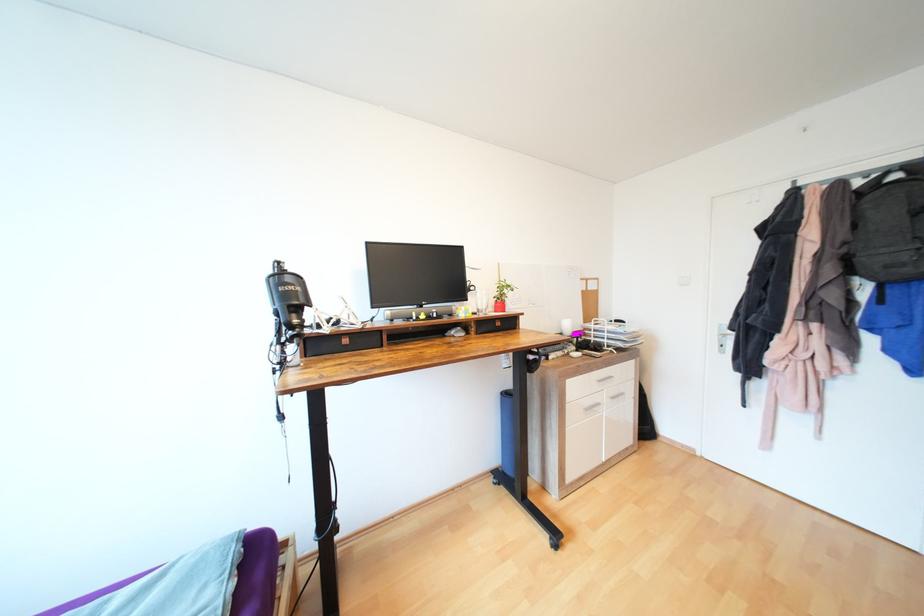
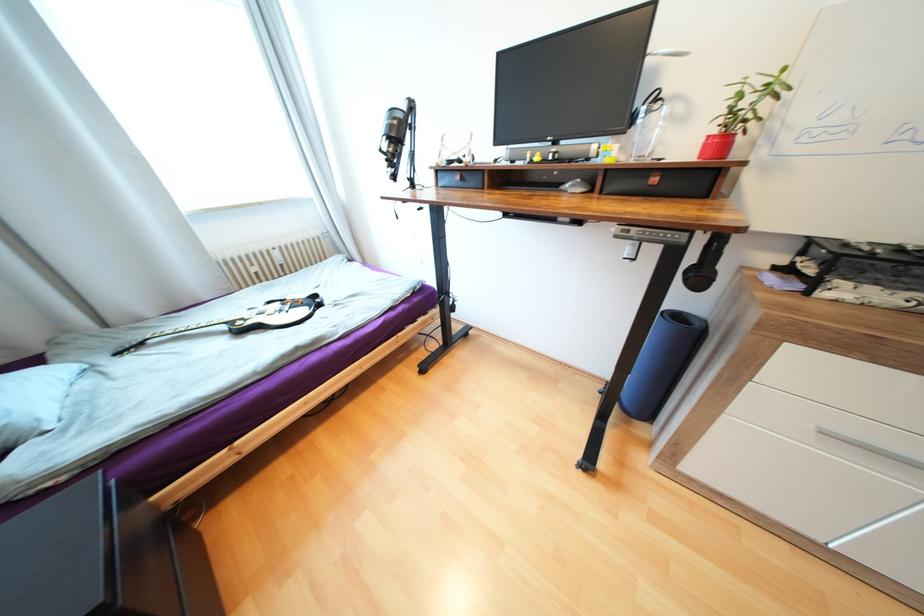
In the second image, find the point that corresponds to point 423,318 in the first image.

(537, 161)